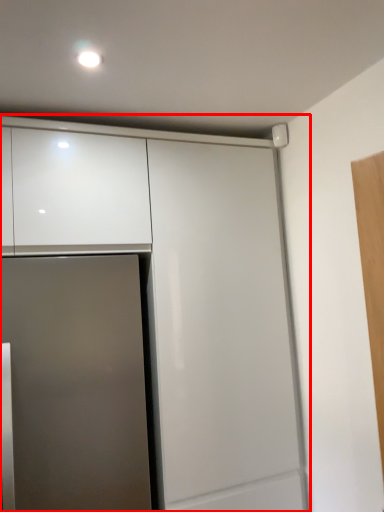
Question: Observing the image, what is the correct spatial positioning of cabinetry (annotated by the red box) in reference to door?

Choices:
 (A) right
 (B) left

Answer: (A)